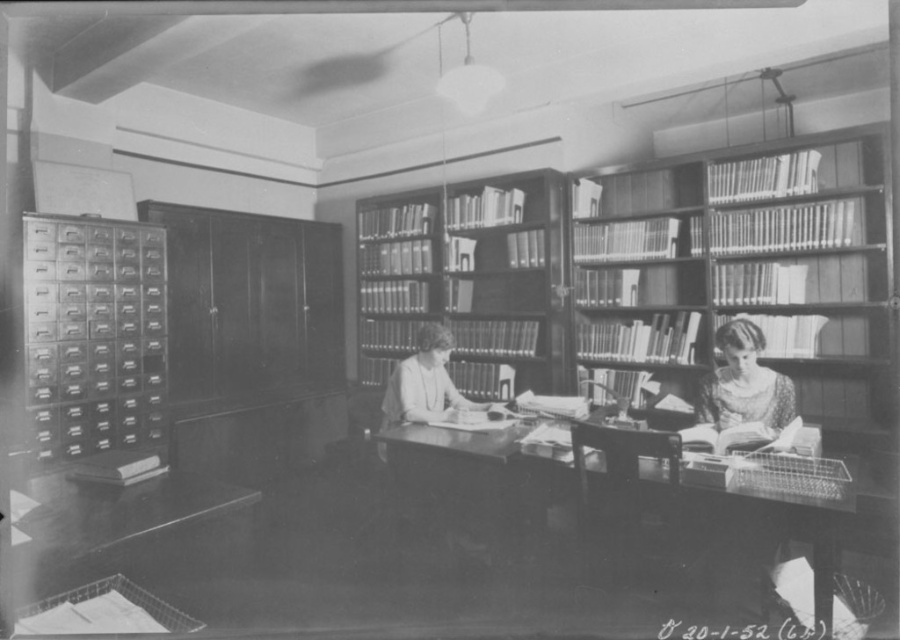
Question: Which of the following is the farthest from the observer?

Choices:
 (A) (774, 422)
 (B) (581, 529)

Answer: (A)

Question: Is wooden desk at center below smooth skin face at lower right?

Choices:
 (A) no
 (B) yes

Answer: (B)

Question: Among these points, which one is nearest to the camera?

Choices:
 (A) (378, 442)
 (B) (713, 413)

Answer: (B)

Question: Among these objects, which one is nearest to the camera?

Choices:
 (A) wooden bookcase at center
 (B) smooth skin face at lower right
 (C) wooden desk at center

Answer: (C)

Question: Is wooden desk at center below smooth skin face at lower right?

Choices:
 (A) no
 (B) yes

Answer: (B)

Question: Is wooden desk at center in front of wooden bookcase at center?

Choices:
 (A) yes
 (B) no

Answer: (A)